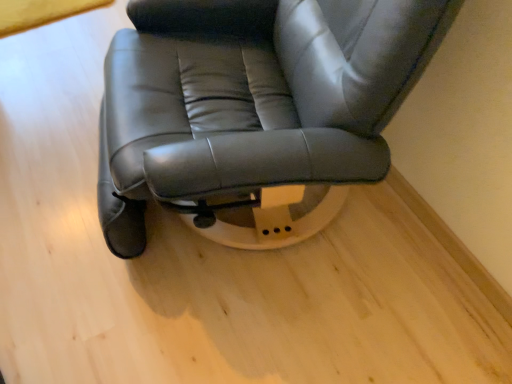
Measure the distance between point (163, 187) and camera.

A distance of 33.82 inches exists between point (163, 187) and camera.

The height and width of the screenshot is (384, 512). Describe the element at coordinates (254, 111) in the screenshot. I see `matte black chair at center` at that location.

The image size is (512, 384). Identify the location of matte black chair at center. (254, 111).

The width and height of the screenshot is (512, 384). Identify the location of matte black chair at center. (254, 111).